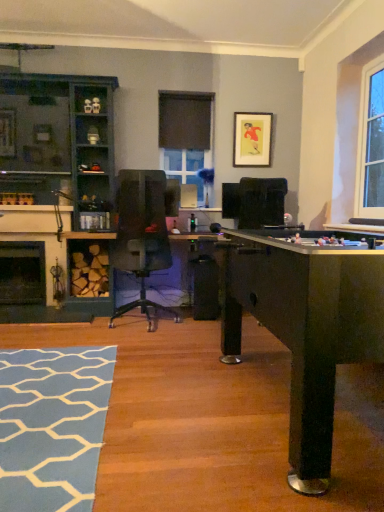
Question: Does teal wood cabinet at left appear on the right side of transparent glass window screen at center?

Choices:
 (A) no
 (B) yes

Answer: (A)

Question: Is teal wood cabinet at left oriented towards transparent glass window screen at center?

Choices:
 (A) no
 (B) yes

Answer: (A)

Question: Considering the relative sizes of teal wood cabinet at left and transparent glass window screen at center in the image provided, is teal wood cabinet at left wider than transparent glass window screen at center?

Choices:
 (A) no
 (B) yes

Answer: (B)

Question: Is teal wood cabinet at left directly adjacent to transparent glass window screen at center?

Choices:
 (A) no
 (B) yes

Answer: (A)

Question: Can you confirm if teal wood cabinet at left is smaller than transparent glass window screen at center?

Choices:
 (A) no
 (B) yes

Answer: (A)

Question: In terms of width, does black matte fireplace at lower left, placed as the 1th fireplace when sorted from front to back, look wider or thinner when compared to black stone fireplace at lower left, which appears as the second fireplace when viewed from the front?

Choices:
 (A) wide
 (B) thin

Answer: (B)

Question: In terms of size, does black matte fireplace at lower left, placed as the 1th fireplace when sorted from front to back, appear bigger or smaller than black stone fireplace at lower left, which is the first fireplace in back-to-front order?

Choices:
 (A) small
 (B) big

Answer: (A)

Question: Is black matte fireplace at lower left, placed as the 1th fireplace when sorted from front to back, situated inside black stone fireplace at lower left, which appears as the second fireplace when viewed from the front, or outside?

Choices:
 (A) inside
 (B) outside

Answer: (A)

Question: From the image's perspective, is black matte fireplace at lower left, which is the second fireplace in back-to-front order, located above or below black stone fireplace at lower left, which is the first fireplace in back-to-front order?

Choices:
 (A) above
 (B) below

Answer: (A)

Question: Is black stone fireplace at lower left, which appears as the second fireplace when viewed from the front, inside the boundaries of teal wood cabinet at left, or outside?

Choices:
 (A) inside
 (B) outside

Answer: (B)

Question: From the image's perspective, is black stone fireplace at lower left, which appears as the second fireplace when viewed from the front, located above or below teal wood cabinet at left?

Choices:
 (A) above
 (B) below

Answer: (B)

Question: Considering the positions of black stone fireplace at lower left, which is the first fireplace in back-to-front order, and teal wood cabinet at left in the image, is black stone fireplace at lower left, which is the first fireplace in back-to-front order, taller or shorter than teal wood cabinet at left?

Choices:
 (A) short
 (B) tall

Answer: (A)

Question: Relative to teal wood cabinet at left, is black stone fireplace at lower left, which appears as the second fireplace when viewed from the front, in front or behind?

Choices:
 (A) front
 (B) behind

Answer: (B)

Question: Is point (64, 261) positioned closer to the camera than point (200, 162)?

Choices:
 (A) closer
 (B) farther

Answer: (A)

Question: Based on their sizes in the image, would you say black matte fireplace at lower left, which is the second fireplace in back-to-front order, is bigger or smaller than transparent glass window screen at center?

Choices:
 (A) small
 (B) big

Answer: (B)